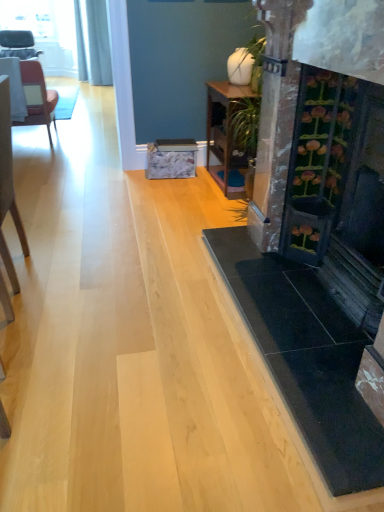
What do you see at coordinates (8, 185) in the screenshot? Image resolution: width=384 pixels, height=512 pixels. I see `light brown wooden chair at left, which is the 3th chair in left-to-right order` at bounding box center [8, 185].

In order to click on light brown wooden chair at left, which appears as the 1th chair when viewed from the front in this screenshot , I will do `click(8, 185)`.

Identify the location of dark wood fireplace at right. Image resolution: width=384 pixels, height=512 pixels. (318, 228).

You are a GUI agent. You are given a task and a screenshot of the screen. Output one action in this format:
    pyautogui.click(x=<x>, y=<y>)
    Task: Click on the matte black chair at upper left, the 1th chair in the back-to-front sequence
    
    Given the screenshot: What is the action you would take?
    (18, 44)

From a real-world perspective, is matte black chair at upper left, which ranks as the first chair in top-to-bottom order, physically above light brown wooden chair at left, the first chair in the bottom-to-top sequence?

Indeed, from a real-world perspective, matte black chair at upper left, which ranks as the first chair in top-to-bottom order, stands above light brown wooden chair at left, the first chair in the bottom-to-top sequence.

Where is `the 2nd chair above when counting from the light brown wooden chair at left, which appears as the 1th chair when viewed from the front (from the image's perspective)`? This screenshot has height=512, width=384. the 2nd chair above when counting from the light brown wooden chair at left, which appears as the 1th chair when viewed from the front (from the image's perspective) is located at coordinates (18, 44).

Is point (25, 50) less distant than point (23, 227)?

No, (25, 50) is further to viewer.

Considering the sizes of objects matte black chair at upper left, the third chair from the bottom, and light brown wooden chair at left, the third chair in the top-to-bottom sequence, in the image provided, who is taller, matte black chair at upper left, the third chair from the bottom, or light brown wooden chair at left, the third chair in the top-to-bottom sequence,?

Standing taller between the two is light brown wooden chair at left, the third chair in the top-to-bottom sequence.

Is light brown wooden chair at left, the first chair in the bottom-to-top sequence, in contact with matte black chair at upper left, which ranks as the first chair in top-to-bottom order?

light brown wooden chair at left, the first chair in the bottom-to-top sequence, and matte black chair at upper left, which ranks as the first chair in top-to-bottom order, are clearly separated.

Which is further, (11, 276) or (12, 33)?

The point (12, 33) is farther.

From a real-world perspective, which is physically below, light brown wooden chair at left, the third chair in the top-to-bottom sequence, or matte black chair at upper left, arranged as the 1th chair when viewed from the left?

In real-world perspective, light brown wooden chair at left, the third chair in the top-to-bottom sequence, is lower.

From the image's perspective, is light brown wooden chair at left, the third chair in the top-to-bottom sequence, located above or below matte black chair at upper left, arranged as the 1th chair when viewed from the left?

Clearly, from the image's perspective, light brown wooden chair at left, the third chair in the top-to-bottom sequence, is below matte black chair at upper left, arranged as the 1th chair when viewed from the left.

Is wooden table at center, the 1th table from the front, directly adjacent to matte brown chair at left, positioned as the 2th chair in bottom-to-top order?

No, wooden table at center, the 1th table from the front, is not with matte brown chair at left, positioned as the 2th chair in bottom-to-top order.

Between wooden table at center, which is the first table in right-to-left order, and matte brown chair at left, which ranks as the 2th chair in back-to-front order, which one has larger size?

matte brown chair at left, which ranks as the 2th chair in back-to-front order.

Measure the distance between wooden table at center, which is the first table in right-to-left order, and matte brown chair at left, the 2th chair from the front.

1.68 meters.

Is the position of wooden table at center, the 1th table from the front, less distant than that of matte brown chair at left, arranged as the second chair when viewed from the top?

Yes, wooden table at center, the 1th table from the front, is in front of matte brown chair at left, arranged as the second chair when viewed from the top.

Does dark wood fireplace at right turn towards wooden table at center, which is the second table in left-to-right order?

No, dark wood fireplace at right is not turned towards wooden table at center, which is the second table in left-to-right order.

How many degrees apart are the facing directions of dark wood fireplace at right and wooden table at center, acting as the 1th table starting from the bottom?

The angle between the facing direction of dark wood fireplace at right and the facing direction of wooden table at center, acting as the 1th table starting from the bottom, is 1.15 degrees.

From a real-world perspective, is dark wood fireplace at right positioned over wooden table at center, acting as the 2th table starting from the back, based on gravity?

Indeed, from a real-world perspective, dark wood fireplace at right stands above wooden table at center, acting as the 2th table starting from the back.

Locate an element on the screen. the 2nd table positioned below the dark wood fireplace at right (from a real-world perspective) is located at coordinates (225, 126).

Who is smaller, white fabric table at left, which is counted as the 1th table, starting from the back, or matte black chair at upper left, the 1th chair in the back-to-front sequence?

Smaller between the two is white fabric table at left, which is counted as the 1th table, starting from the back.

Are white fabric table at left, the 2th table positioned from the right, and matte black chair at upper left, which ranks as the first chair in top-to-bottom order, located far from each other?

That's not correct — white fabric table at left, the 2th table positioned from the right, is a little close to matte black chair at upper left, which ranks as the first chair in top-to-bottom order.

Is white fabric table at left, which is counted as the 1th table, starting from the back, spatially inside matte black chair at upper left, arranged as the 1th chair when viewed from the left, or outside of it?

The correct answer is: outside.

Which of these two, dark wood fireplace at right or white fabric table at left, arranged as the 2th table when ordered from the bottom, stands shorter?

white fabric table at left, arranged as the 2th table when ordered from the bottom, is shorter.

Which object is closer to the camera, dark wood fireplace at right or white fabric table at left, the 1th table when ordered from left to right?

Positioned in front is dark wood fireplace at right.

Where is `the 2nd table above the dark wood fireplace at right (from the image's perspective)`? the 2nd table above the dark wood fireplace at right (from the image's perspective) is located at coordinates (14, 87).

Do you think dark wood fireplace at right is within white fabric table at left, which is counted as the first table, starting from the top, or outside of it?

dark wood fireplace at right lies outside white fabric table at left, which is counted as the first table, starting from the top.

Can you confirm if matte black chair at upper left, arranged as the 1th chair when viewed from the left, is positioned to the left of dark wood fireplace at right?

Correct, you'll find matte black chair at upper left, arranged as the 1th chair when viewed from the left, to the left of dark wood fireplace at right.

Is matte black chair at upper left, the 3th chair from the front, with dark wood fireplace at right?

No.

From the image's perspective, does matte black chair at upper left, which ranks as the first chair in top-to-bottom order, appear higher than dark wood fireplace at right?

A: Yes.

Is dark wood fireplace at right at the back of matte black chair at upper left, the 3th chair from the front?

No, matte black chair at upper left, the 3th chair from the front, is not facing the opposite direction of dark wood fireplace at right.

Where is `chair that is the 1st one below the matte black chair at upper left, the third chair from the bottom (from a real-world perspective)`? This screenshot has height=512, width=384. chair that is the 1st one below the matte black chair at upper left, the third chair from the bottom (from a real-world perspective) is located at coordinates (8, 185).

From the matte black chair at upper left, the third chair from the right, count 2nd chairs forward and point to it. Please provide its 2D coordinates.

[(8, 185)]

From the image, which object appears to be nearer to wooden table at center, acting as the 1th table starting from the bottom, matte brown chair at left, the 2th chair from the front, or light brown wooden chair at left, the third chair in the top-to-bottom sequence?

light brown wooden chair at left, the third chair in the top-to-bottom sequence, is closer to wooden table at center, acting as the 1th table starting from the bottom.

Estimate the real-world distances between objects in this image. Which object is further from light brown wooden chair at left, which is the 3th chair in left-to-right order, wooden table at center, the 1th table from the front, or dark wood fireplace at right?

wooden table at center, the 1th table from the front, lies further to light brown wooden chair at left, which is the 3th chair in left-to-right order, than the other object.

From the picture: Looking at the image, which one is located closer to dark wood fireplace at right, light brown wooden chair at left, the third chair in the top-to-bottom sequence, or matte brown chair at left, positioned as the 2th chair in bottom-to-top order?

light brown wooden chair at left, the third chair in the top-to-bottom sequence, lies closer to dark wood fireplace at right than the other object.

When comparing their distances from white fabric table at left, which is counted as the first table, starting from the top, does matte brown chair at left, the 2th chair from the front, or matte black chair at upper left, the 1th chair in the back-to-front sequence, seem further?

The object further to white fabric table at left, which is counted as the first table, starting from the top, is matte black chair at upper left, the 1th chair in the back-to-front sequence.

Based on the photo, looking at the image, which one is located closer to light brown wooden chair at left, which appears as the first chair when viewed from the right, dark wood fireplace at right or matte black chair at upper left, the third chair from the bottom?

dark wood fireplace at right.

From the image, which object appears to be farther from matte black chair at upper left, the 1th chair in the back-to-front sequence, matte brown chair at left, which ranks as the 2th chair in back-to-front order, or light brown wooden chair at left, the third chair in the top-to-bottom sequence?

light brown wooden chair at left, the third chair in the top-to-bottom sequence.

Estimate the real-world distances between objects in this image. Which object is further from dark wood fireplace at right, wooden table at center, acting as the 2th table starting from the back, or light brown wooden chair at left, acting as the 3th chair starting from the back?

light brown wooden chair at left, acting as the 3th chair starting from the back, lies further to dark wood fireplace at right than the other object.

Considering their positions, is light brown wooden chair at left, the first chair in the bottom-to-top sequence, positioned further to white fabric table at left, which is counted as the 1th table, starting from the back, than matte black chair at upper left, the third chair from the bottom?

Based on the image, light brown wooden chair at left, the first chair in the bottom-to-top sequence, appears to be further to white fabric table at left, which is counted as the 1th table, starting from the back.

The image size is (384, 512). What are the coordinates of `chair positioned between light brown wooden chair at left, which appears as the first chair when viewed from the right, and matte black chair at upper left, the 1th chair in the back-to-front sequence, from near to far` in the screenshot? It's located at (37, 97).

This screenshot has height=512, width=384. I want to click on table between light brown wooden chair at left, acting as the 3th chair starting from the back, and white fabric table at left, the second table in the front-to-back sequence, along the z-axis, so click(x=225, y=126).

Image resolution: width=384 pixels, height=512 pixels. I want to click on table between matte brown chair at left, which ranks as the 2th chair in back-to-front order, and wooden table at center, acting as the 1th table starting from the bottom, in the horizontal direction, so click(14, 87).

I want to click on chair between dark wood fireplace at right and white fabric table at left, which is counted as the first table, starting from the top, from front to back, so click(8, 185).